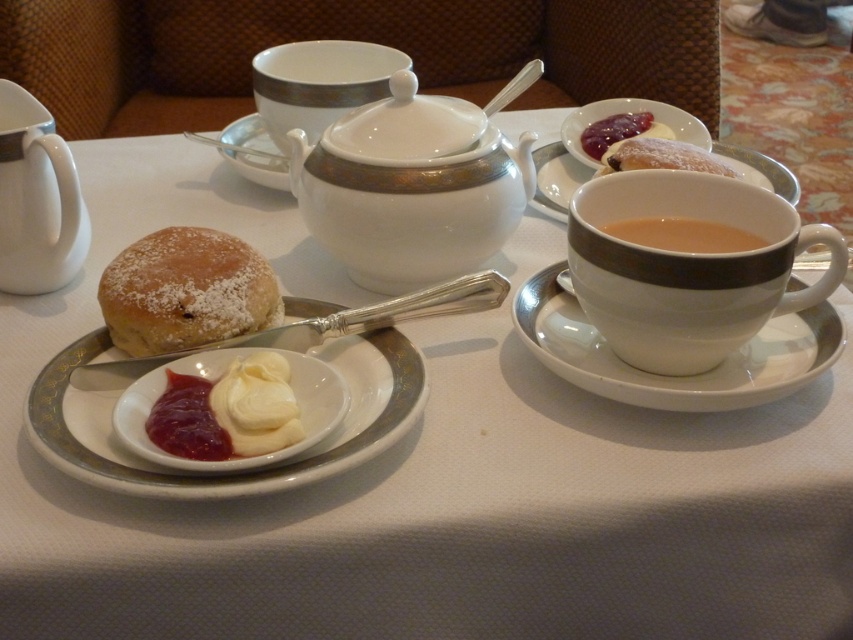
You are setting up a tea service and need to place the white porcelain platter at center and the brown matte cup at center right on the table. Given that the table has limited space, which object should you prioritize placing first to ensure both fit properly?

The white porcelain platter at center is bigger than the brown matte cup at center right, so you should prioritize placing the white porcelain platter at center first to ensure both fit properly.

You are setting up a tea service and need to place both the white porcelain platter at center and the smooth white cream at center on a shelf that can only accommodate items up to the size of the platter. Can both items fit on the shelf?

The white porcelain platter at center is wider than the smooth white cream at center. Since the shelf can only hold items up to the size of the platter, the cream will fit, but the platter itself must be placed first as it is the larger item.

You are a tea server preparing a formal tea service. You have a white porcelain platter at center and a smooth white cream at center. Which item is taller?

The white porcelain platter at center is taller than the smooth white cream at center.